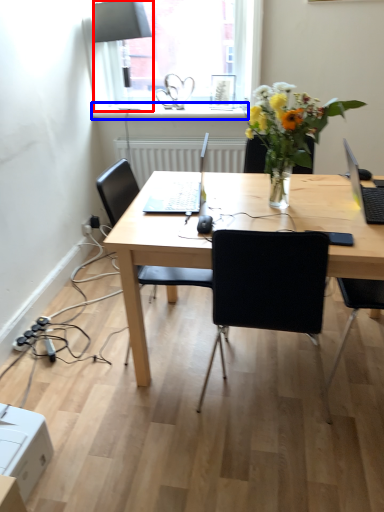
Question: Which object is closer to the camera taking this photo, lamp (highlighted by a red box) or window sill (highlighted by a blue box)?

Choices:
 (A) lamp
 (B) window sill

Answer: (A)